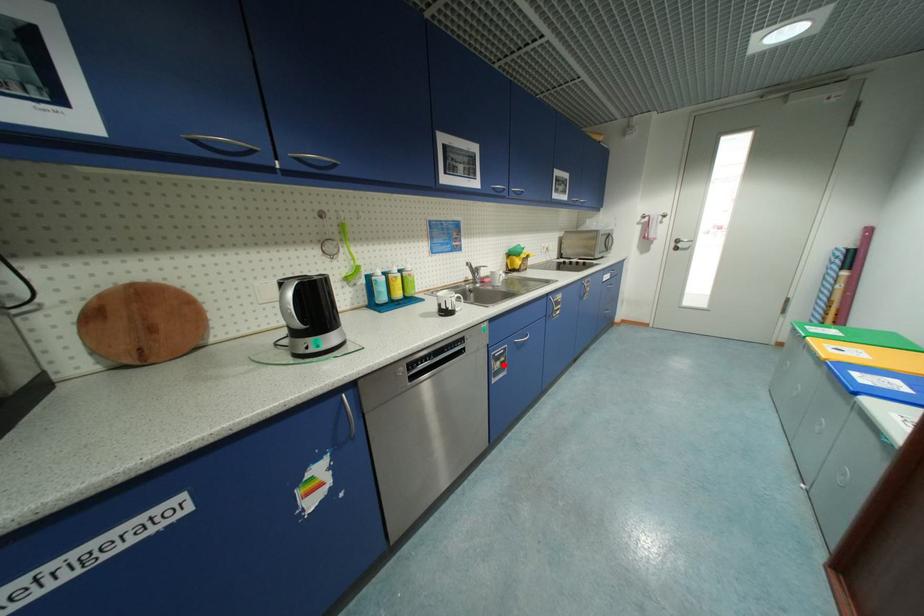
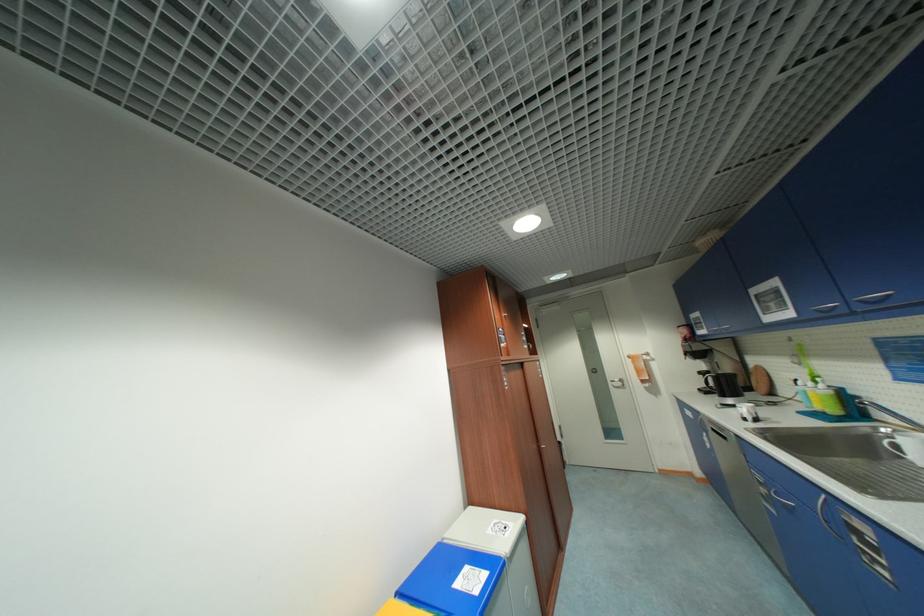
Where in the second image is the point corresponding to the highlighted location from the first image?

(768, 491)